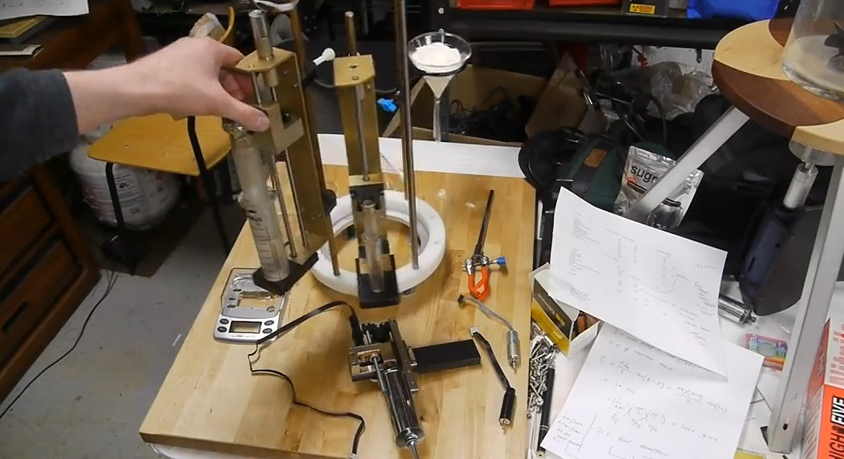
Identify the location of round brown table. (772, 97).